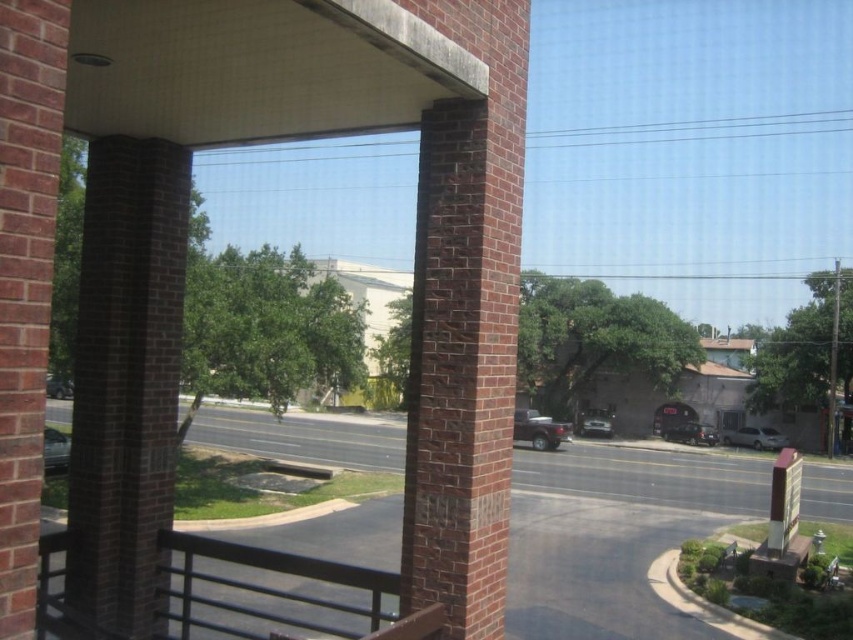
Question: Which of these objects is positioned closest to the black metal/rail at lower center?

Choices:
 (A) clear glass window at center
 (B) metallic silver car at center
 (C) silver metallic van at lower right

Answer: (B)

Question: Is shiny black car at lower left closer to the viewer compared to matte black suv at center?

Choices:
 (A) no
 (B) yes

Answer: (B)

Question: Among these objects, which one is farthest from the camera?

Choices:
 (A) metallic silver car at center
 (B) shiny black car at lower left

Answer: (A)

Question: Does brick at left lie behind matte black truck at center?

Choices:
 (A) no
 (B) yes

Answer: (B)

Question: Which object is the farthest from the black metal/rail at lower center?

Choices:
 (A) silver metallic van at lower right
 (B) matte black suv at center
 (C) clear glass window at center
 (D) metallic silver car at center

Answer: (C)

Question: Can you confirm if silver metallic van at lower right is bigger than matte black car at lower left?

Choices:
 (A) yes
 (B) no

Answer: (B)